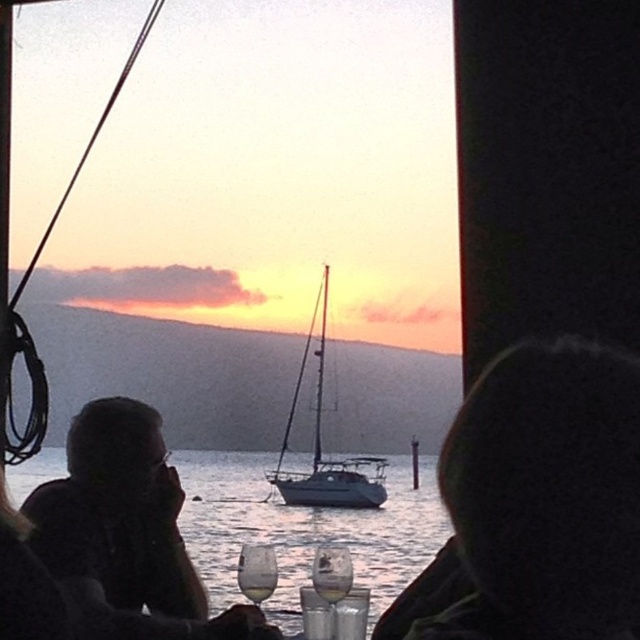
The image size is (640, 640). What do you see at coordinates (305, 528) in the screenshot? I see `clear water at center` at bounding box center [305, 528].

Does clear water at center have a smaller size compared to clear glass wine at center?

No, clear water at center is not smaller than clear glass wine at center.

Is point (435, 493) positioned in front of point (326, 586)?

No, it is not.

The height and width of the screenshot is (640, 640). What are the coordinates of `clear water at center` in the screenshot? It's located at (305, 528).

Is white matte sailboat at center below clear glass wine at lower center?

Yes.

Is white matte sailboat at center above clear glass wine at lower center?

No, white matte sailboat at center is not above clear glass wine at lower center.

What are the coordinates of `white matte sailboat at center` in the screenshot? It's located at (321, 448).

Between silhouette hair at center and matte black hair at upper left, which one is positioned higher?

matte black hair at upper left

Between point (470, 508) and point (556, 611), which one is positioned behind?

Point (470, 508)

Does point (532, 353) come behind point (525, 580)?

Yes, it is behind point (525, 580).

Where is `silhouette hair at center`? Image resolution: width=640 pixels, height=640 pixels. silhouette hair at center is located at coordinates (545, 493).